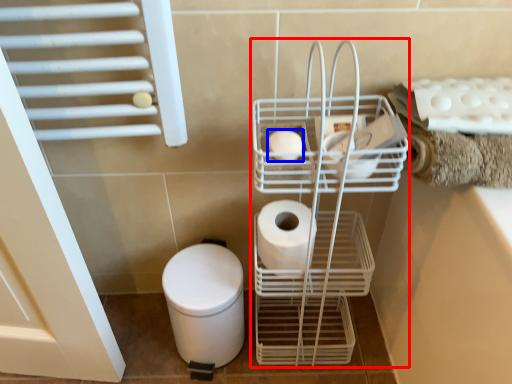
Question: Which object is further to the camera taking this photo, trolley (highlighted by a red box) or toilet paper (highlighted by a blue box)?

Choices:
 (A) trolley
 (B) toilet paper

Answer: (B)